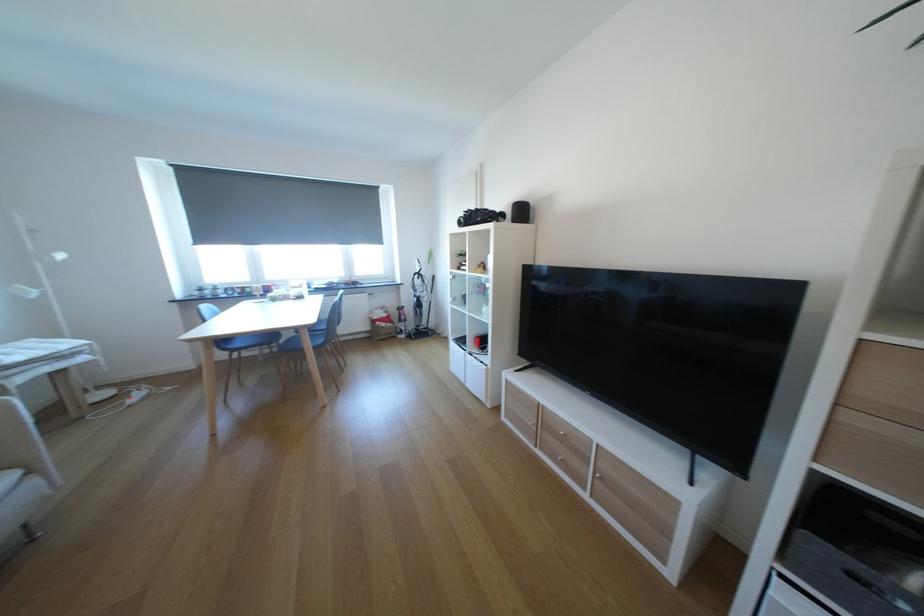
Locate an element on the screen. This screenshot has height=616, width=924. fabric box handle is located at coordinates (383, 328).